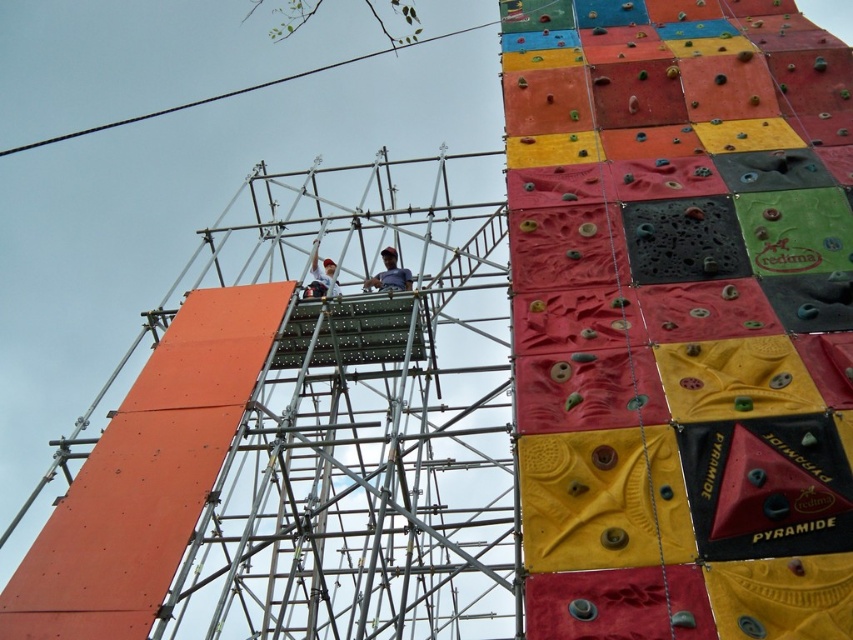
Does metallic scaffolding at center appear over white matte shirt at center?

Actually, metallic scaffolding at center is below white matte shirt at center.

Who is more distant from viewer, (x=9, y=541) or (x=325, y=280)?

Positioned behind is point (x=9, y=541).

This screenshot has width=853, height=640. What do you see at coordinates (299, 429) in the screenshot?
I see `metallic scaffolding at center` at bounding box center [299, 429].

Image resolution: width=853 pixels, height=640 pixels. I want to click on metallic scaffolding at center, so click(299, 429).

Who is shorter, matte black helmet at center or white matte shirt at center?

matte black helmet at center

Does matte black helmet at center have a greater height compared to white matte shirt at center?

No, matte black helmet at center is not taller than white matte shirt at center.

Measure the distance between matte black helmet at center and camera.

matte black helmet at center is 244.75 feet away from camera.

Where is `matte black helmet at center`? The image size is (853, 640). matte black helmet at center is located at coordinates (389, 273).

Does metallic scaffolding at center have a lesser width compared to matte black helmet at center?

Incorrect, metallic scaffolding at center's width is not less than matte black helmet at center's.

Describe the element at coordinates (299, 429) in the screenshot. I see `metallic scaffolding at center` at that location.

Where is `metallic scaffolding at center`? The width and height of the screenshot is (853, 640). metallic scaffolding at center is located at coordinates (299, 429).